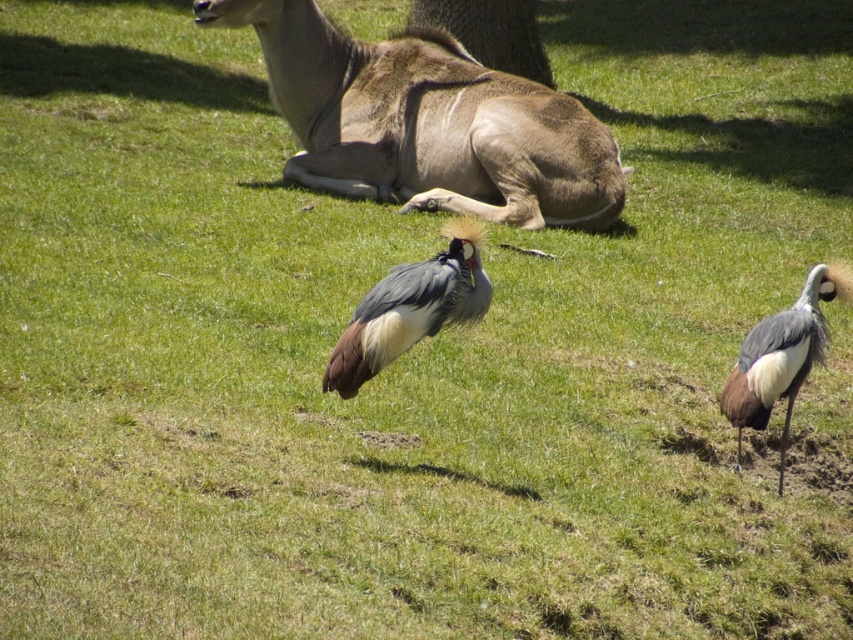
Question: Does gray feathered bird at center have a lesser width compared to gray matte bird at right?

Choices:
 (A) yes
 (B) no

Answer: (B)

Question: Does brown fur deer at upper center have a lesser width compared to brown textured tree trunk at upper center?

Choices:
 (A) no
 (B) yes

Answer: (A)

Question: Which point appears closest to the camera in this image?

Choices:
 (A) (421, 184)
 (B) (451, 227)

Answer: (B)

Question: Which point appears closest to the camera in this image?

Choices:
 (A) tap(531, 8)
 (B) tap(426, 144)

Answer: (B)

Question: Estimate the real-world distances between objects in this image. Which object is closer to the gray matte bird at right?

Choices:
 (A) brown fur deer at upper center
 (B) gray feathered bird at center

Answer: (B)

Question: In this image, where is gray feathered bird at center located relative to gray matte bird at right?

Choices:
 (A) right
 (B) left

Answer: (B)